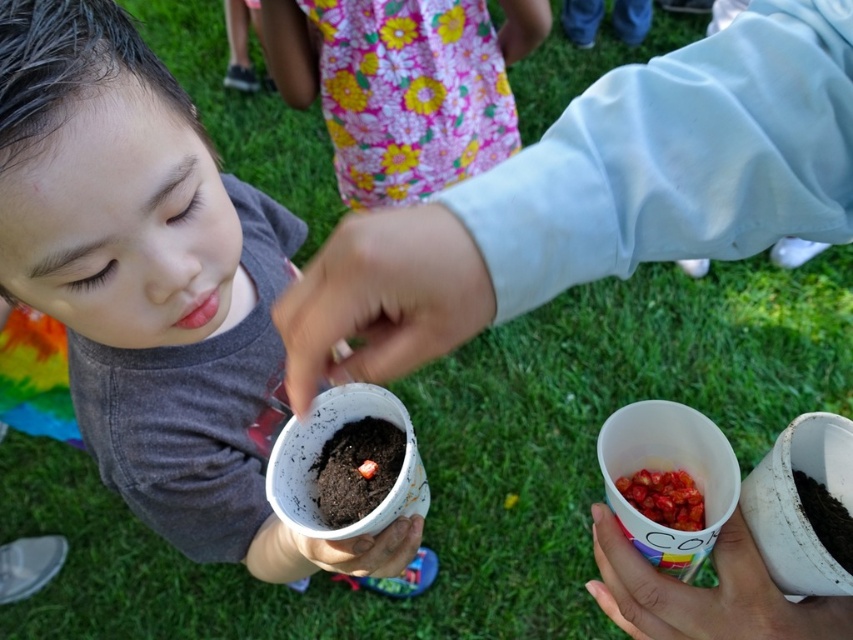
Question: Which of the following is the farthest from the observer?

Choices:
 (A) brown soil seed at center
 (B) white matte cup at lower right
 (C) smooth skin at center

Answer: (A)

Question: Is brown soil seed at center below matte plastic cup at lower center?

Choices:
 (A) no
 (B) yes

Answer: (A)

Question: Is brown soil seed at center bigger than matte plastic cup at lower center?

Choices:
 (A) yes
 (B) no

Answer: (B)

Question: Can you confirm if matte gray shirt at center is thinner than matte plastic cup at lower center?

Choices:
 (A) no
 (B) yes

Answer: (A)

Question: Which point is closer to the camera taking this photo?

Choices:
 (A) (170, 216)
 (B) (428, 285)
 (C) (834, 625)
 (D) (357, 481)

Answer: (B)

Question: Estimate the real-world distances between objects in this image. Which object is farther from the matte plastic cup at lower center?

Choices:
 (A) white matte cup at lower right
 (B) smooth skin at center
 (C) brown soil seed at center
 (D) matte gray shirt at center

Answer: (B)